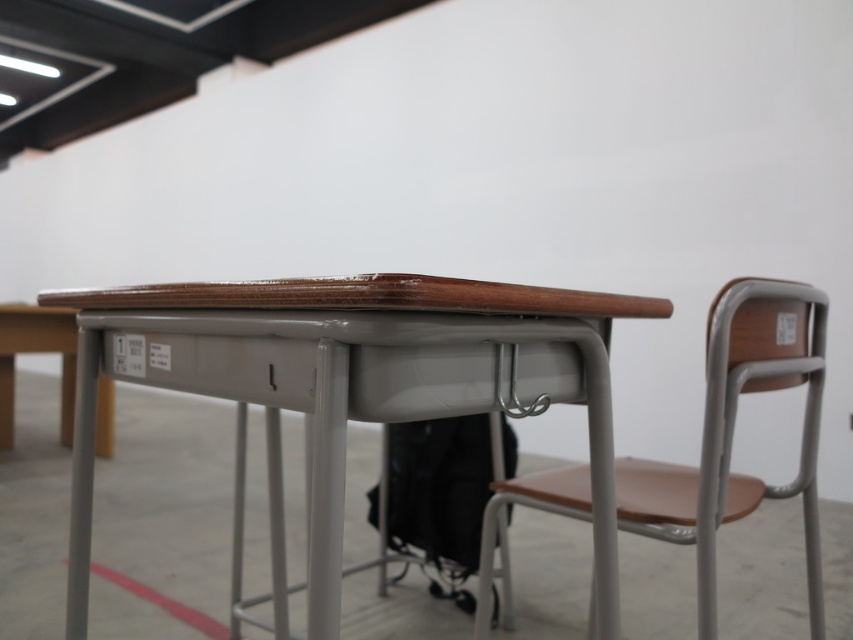
Question: Is wooden/matte table at center wider than brown wood chair at center?

Choices:
 (A) yes
 (B) no

Answer: (A)

Question: Which object is farther from the camera taking this photo?

Choices:
 (A) brown wood chair at center
 (B) wooden/matte table at center

Answer: (A)

Question: Is wooden/matte table at center thinner than brown wood chair at center?

Choices:
 (A) no
 (B) yes

Answer: (A)

Question: Is wooden/matte table at center positioned behind brown wood chair at center?

Choices:
 (A) no
 (B) yes

Answer: (A)

Question: Which point is closer to the camera?

Choices:
 (A) (726, 440)
 (B) (383, 369)

Answer: (B)